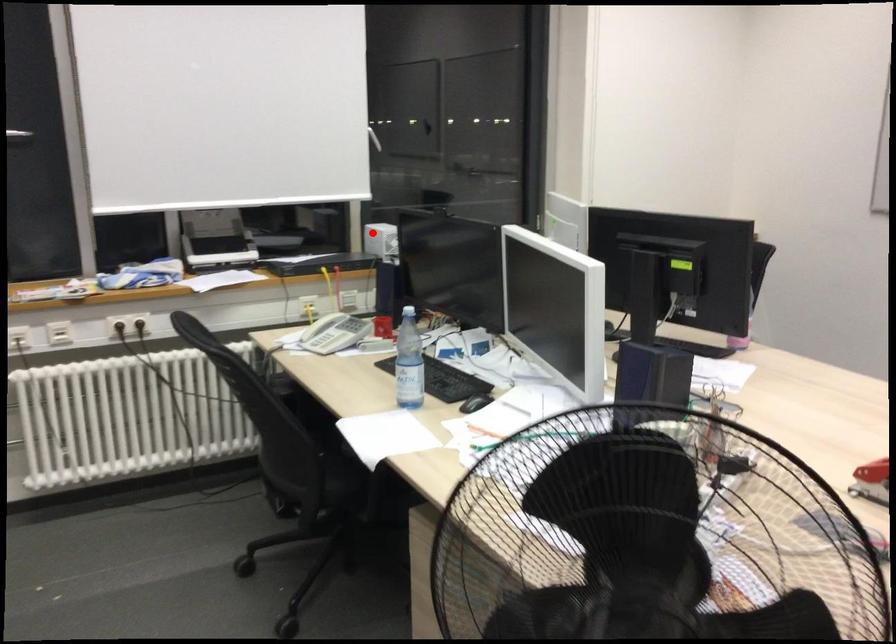
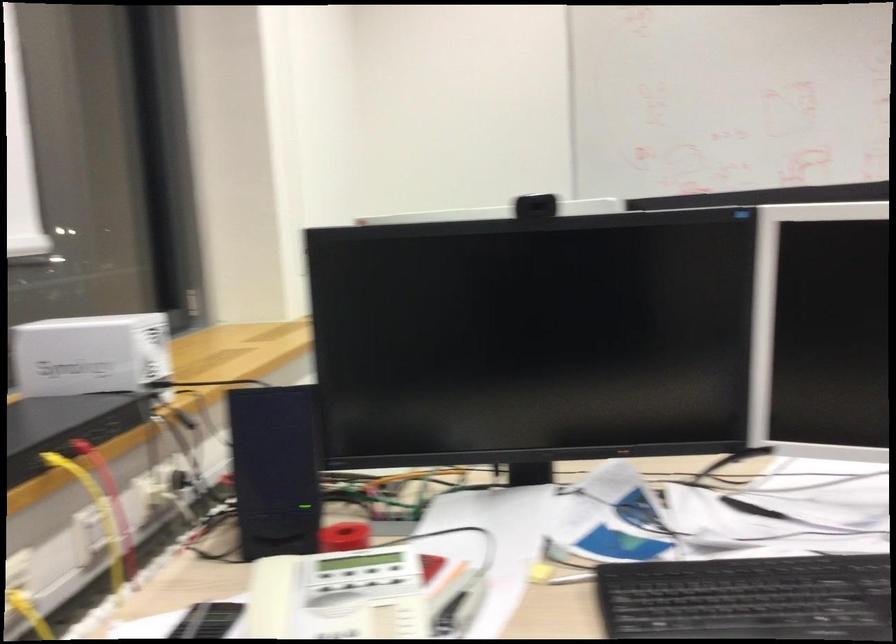
Find the pixel in the second image that matches the highlighted location in the first image.

(90, 354)